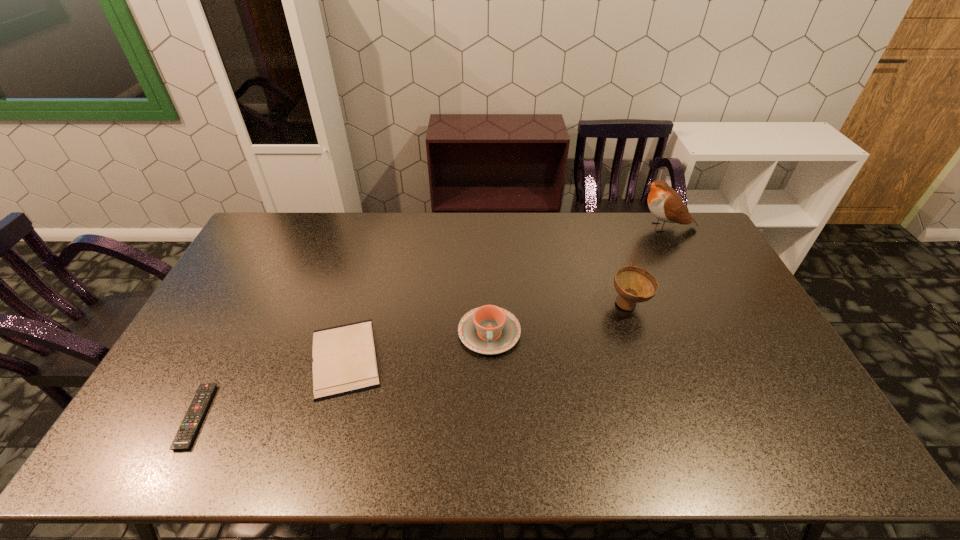
Where is `vacant region between the chinaware and the farthest object`? vacant region between the chinaware and the farthest object is located at coordinates (577, 280).

What are the coordinates of `empty space between the fourth tallest object and the tallest object` in the screenshot? It's located at (505, 293).

Locate an element on the screen. The width and height of the screenshot is (960, 540). free space between the farthest object and the chinaware is located at coordinates (577, 280).

At what (x,y) coordinates should I click in order to perform the action: click on unoccupied area between the third tallest object and the second shortest object. Please return your answer as a coordinate pair (x, y). This screenshot has height=540, width=960. Looking at the image, I should click on (418, 345).

At what (x,y) coordinates should I click in order to perform the action: click on free space between the soup bowl and the leftmost object. Please return your answer as a coordinate pair (x, y). Looking at the image, I should click on coord(413,361).

At what (x,y) coordinates should I click in order to perform the action: click on vacant point located between the second object from right to left and the farthest object. Please return your answer as a coordinate pair (x, y). This screenshot has width=960, height=540. Looking at the image, I should click on (647, 266).

The width and height of the screenshot is (960, 540). I want to click on free space between the shortest object and the fourth tallest object, so click(271, 387).

Choose which object is the second nearest neighbor to the remote control. Please provide its 2D coordinates. Your answer should be formatted as a tuple, i.e. [(x, y)], where the tuple contains the x and y coordinates of a point satisfying the conditions above.

[(489, 329)]

This screenshot has height=540, width=960. I want to click on object that can be found as the third closest to the third object from left to right, so click(664, 202).

The height and width of the screenshot is (540, 960). Identify the location of free point that satisfies the following two spatial constraints: 1. at the face of the bird; 2. on the front side of the second shortest object. (732, 357).